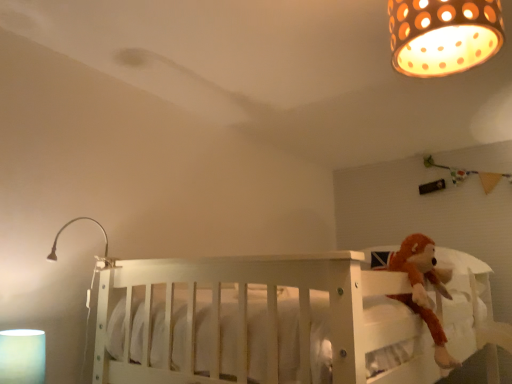
Question: Considering the relative sizes of white wooden crib at center and brown plush monkey at right in the image provided, is white wooden crib at center shorter than brown plush monkey at right?

Choices:
 (A) no
 (B) yes

Answer: (A)

Question: Does white wooden crib at center have a larger size compared to brown plush monkey at right?

Choices:
 (A) yes
 (B) no

Answer: (A)

Question: Considering the relative sizes of white wooden crib at center and brown plush monkey at right in the image provided, is white wooden crib at center wider than brown plush monkey at right?

Choices:
 (A) yes
 (B) no

Answer: (A)

Question: From the image's perspective, is white wooden crib at center located above brown plush monkey at right?

Choices:
 (A) no
 (B) yes

Answer: (A)

Question: Is white wooden crib at center closer to camera compared to brown plush monkey at right?

Choices:
 (A) no
 (B) yes

Answer: (B)

Question: Is white wooden crib at center facing towards brown plush monkey at right?

Choices:
 (A) yes
 (B) no

Answer: (A)

Question: Is matte brown lampshade at upper right, which appears as the third lamp when viewed from the left, positioned before white wooden crib at center?

Choices:
 (A) no
 (B) yes

Answer: (A)

Question: Is matte brown lampshade at upper right, which appears as the third lamp when viewed from the left, positioned with its back to white wooden crib at center?

Choices:
 (A) no
 (B) yes

Answer: (A)

Question: Is white wooden crib at center located within matte brown lampshade at upper right, which appears as the third lamp when viewed from the left?

Choices:
 (A) no
 (B) yes

Answer: (A)

Question: Can you confirm if matte brown lampshade at upper right, the third lamp in the bottom-to-top sequence, is wider than white wooden crib at center?

Choices:
 (A) yes
 (B) no

Answer: (B)

Question: Does matte brown lampshade at upper right, the third lamp in the bottom-to-top sequence, have a smaller size compared to white wooden crib at center?

Choices:
 (A) no
 (B) yes

Answer: (B)

Question: Would you consider matte brown lampshade at upper right, the third lamp in the bottom-to-top sequence, to be distant from white wooden crib at center?

Choices:
 (A) yes
 (B) no

Answer: (B)

Question: Is white matte cylinder at lower left, which is the 3th lamp from top to bottom, facing towards brown plush monkey at right?

Choices:
 (A) no
 (B) yes

Answer: (A)